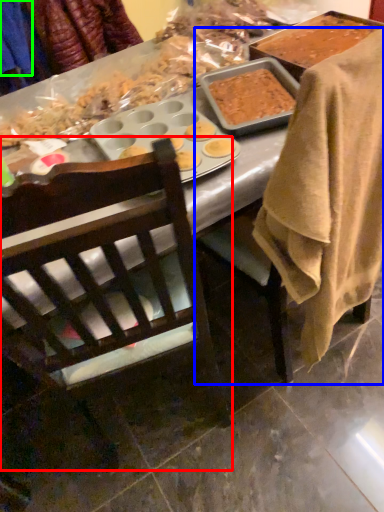
Question: Considering the real-world distances, which object is farthest from chair (highlighted by a red box)? chair (highlighted by a blue box) or clothing (highlighted by a green box)?

Choices:
 (A) chair
 (B) clothing

Answer: (B)